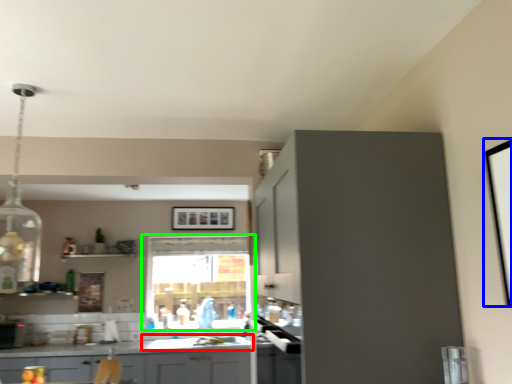
Question: Which is farther away from sink (highlighted by a red box)? picture frame (highlighted by a blue box) or window (highlighted by a green box)?

Choices:
 (A) picture frame
 (B) window

Answer: (A)